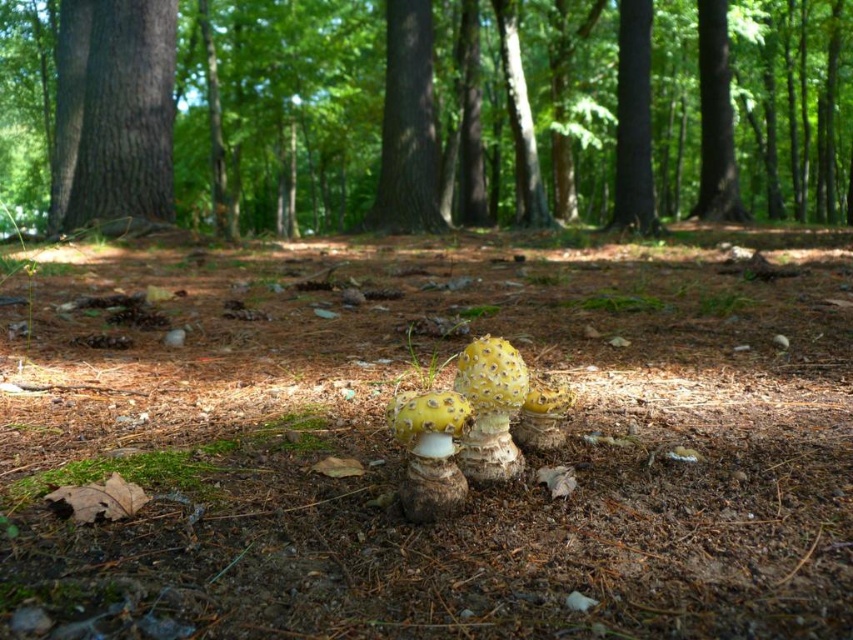
You are a hiker who wants to climb the tallest tree in the forest. Looking at the brown textured tree trunk at center and the smooth bark tree at center, which one should you choose?

The brown textured tree trunk at center is taller than the smooth bark tree at center, so you should choose the brown textured tree trunk at center to climb since it is the tallest.

You are a hiker who wants to take a photo of the brown textured tree trunk at center and the smooth dark brown tree trunk at upper center. Which tree trunk should you focus on first to ensure both are in the frame?

You should focus on the brown textured tree trunk at center first because it is in front of the smooth dark brown tree trunk at upper center, so adjusting the camera to include both would require starting with the closer one.